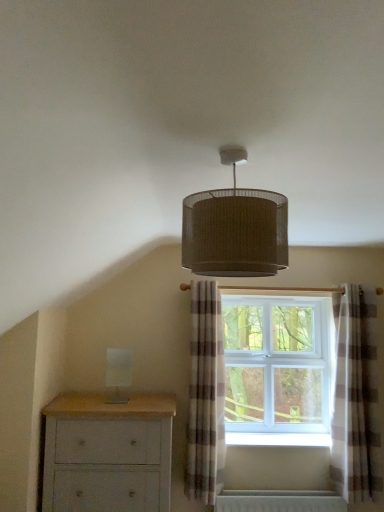
Describe the element at coordinates (118, 375) in the screenshot. I see `matte brown lampshade at upper center` at that location.

The height and width of the screenshot is (512, 384). Find the location of `plaid fabric curtain at center, which appears as the first curtain when viewed from the right`. plaid fabric curtain at center, which appears as the first curtain when viewed from the right is located at coordinates (355, 400).

What do you see at coordinates (355, 400) in the screenshot?
I see `plaid fabric curtain at center, which appears as the first curtain when viewed from the right` at bounding box center [355, 400].

This screenshot has height=512, width=384. Identify the location of light gray painted wood chest of drawers at lower left. (108, 453).

From the image's perspective, which object appears higher, plaid fabric curtain at center, positioned as the second curtain in left-to-right order, or white painted wood at lower center?

plaid fabric curtain at center, positioned as the second curtain in left-to-right order, from the image's perspective.

Considering the sizes of objects plaid fabric curtain at center, which appears as the first curtain when viewed from the right, and white painted wood at lower center in the image provided, who is bigger, plaid fabric curtain at center, which appears as the first curtain when viewed from the right, or white painted wood at lower center?

plaid fabric curtain at center, which appears as the first curtain when viewed from the right, is bigger.

Is plaid fabric curtain at center, positioned as the second curtain in left-to-right order, behind white painted wood at lower center?

No, it is in front of white painted wood at lower center.

Can you tell me how much plaid fabric curtain at center, which appears as the first curtain when viewed from the right, and white painted wood at lower center differ in facing direction?

0.00558 degrees separate the facing orientations of plaid fabric curtain at center, which appears as the first curtain when viewed from the right, and white painted wood at lower center.

Is white plastic window at center to the left or to the right of white painted wood at lower center in the image?

Based on their positions, white plastic window at center is located to the right of white painted wood at lower center.

Considering the sizes of white plastic window at center and white painted wood at lower center in the image, is white plastic window at center wider or thinner than white painted wood at lower center?

In the image, white plastic window at center appears to be more narrow than white painted wood at lower center.

From the picture: Could you tell me if white plastic window at center is facing white painted wood at lower center?

Yes, white plastic window at center is oriented towards white painted wood at lower center.

Does point (277, 356) appear closer or farther from the camera than point (312, 435)?

Clearly, point (277, 356) is more distant from the camera than point (312, 435).

Who is taller, white plastic window at center or plaid fabric curtain at center, positioned as the second curtain in left-to-right order?

plaid fabric curtain at center, positioned as the second curtain in left-to-right order.

Considering the sizes of objects white plastic window at center and plaid fabric curtain at center, which appears as the first curtain when viewed from the right, in the image provided, who is wider, white plastic window at center or plaid fabric curtain at center, which appears as the first curtain when viewed from the right,?

plaid fabric curtain at center, which appears as the first curtain when viewed from the right.

Is white plastic window at center not within plaid fabric curtain at center, positioned as the second curtain in left-to-right order?

white plastic window at center lies outside plaid fabric curtain at center, positioned as the second curtain in left-to-right order,'s area.

From the image's perspective, count 2nd curtains downward from the white plastic window at center and point to it. Please provide its 2D coordinates.

[(355, 400)]

Can you tell me how much plaid fabric curtain at center, the 2th curtain from the right, and light gray painted wood chest of drawers at lower left differ in facing direction?

0.00388 degrees.

From a real-world perspective, is plaid fabric curtain at center, the 2th curtain from the right, positioned over light gray painted wood chest of drawers at lower left based on gravity?

Yes, from a real-world perspective, plaid fabric curtain at center, the 2th curtain from the right, is on top of light gray painted wood chest of drawers at lower left.

You are a GUI agent. You are given a task and a screenshot of the screen. Output one action in this format:
    pyautogui.click(x=<x>, y=<y>)
    Task: Click on the curtain that is the 2nd object above the light gray painted wood chest of drawers at lower left (from a real-world perspective)
    Image resolution: width=384 pixels, height=512 pixels.
    Given the screenshot: What is the action you would take?
    [205, 394]

Considering their positions, is plaid fabric curtain at center, which ranks as the first curtain in left-to-right order, located in front of or behind light gray painted wood chest of drawers at lower left?

Clearly, plaid fabric curtain at center, which ranks as the first curtain in left-to-right order, is behind light gray painted wood chest of drawers at lower left.

Which is closer, (115, 364) or (345, 462)?

Point (115, 364) is positioned closer to the camera compared to point (345, 462).

Between matte brown lampshade at upper center and plaid fabric curtain at center, which appears as the first curtain when viewed from the right, which one has less height?

Standing shorter between the two is matte brown lampshade at upper center.

Considering the sizes of objects matte brown lampshade at upper center and plaid fabric curtain at center, positioned as the second curtain in left-to-right order, in the image provided, who is smaller, matte brown lampshade at upper center or plaid fabric curtain at center, positioned as the second curtain in left-to-right order,?

Smaller between the two is matte brown lampshade at upper center.

Is matte brown lampshade at upper center not within plaid fabric curtain at center, which appears as the first curtain when viewed from the right?

Yes, matte brown lampshade at upper center is outside of plaid fabric curtain at center, which appears as the first curtain when viewed from the right.

Which is less distant, (380, 470) or (261, 194)?

Point (261, 194)

From the image's perspective, relative to matte brown fabric lampshade at center, is plaid fabric curtain at center, which appears as the first curtain when viewed from the right, above or below?

plaid fabric curtain at center, which appears as the first curtain when viewed from the right, is situated lower than matte brown fabric lampshade at center in the image.

Between plaid fabric curtain at center, which appears as the first curtain when viewed from the right, and matte brown fabric lampshade at center, which one has smaller size?

matte brown fabric lampshade at center is smaller.

Looking at this image, can you confirm if plaid fabric curtain at center, positioned as the second curtain in left-to-right order, is shorter than matte brown fabric lampshade at center?

No.

Looking at this image, is white plastic window at center inside white painted wood at lower center?

No.

Does point (273, 445) come farther from viewer compared to point (239, 296)?

That is False.

Locate an element on the screen. The image size is (384, 512). window on the right of white painted wood at lower center is located at coordinates (277, 368).

From the image's perspective, is white painted wood at lower center beneath white plastic window at center?

Indeed, from the image's perspective, white painted wood at lower center is shown beneath white plastic window at center.

From the image's perspective, count 1st curtains upward from the white painted wood at lower center and point to it. Please provide its 2D coordinates.

[(355, 400)]

This screenshot has width=384, height=512. Find the location of `window behind the white painted wood at lower center`. window behind the white painted wood at lower center is located at coordinates (277, 368).

Looking at the image, which one is located closer to light gray painted wood chest of drawers at lower left, matte brown fabric lampshade at center or plaid fabric curtain at center, which ranks as the first curtain in left-to-right order?

Based on the image, plaid fabric curtain at center, which ranks as the first curtain in left-to-right order, appears to be nearer to light gray painted wood chest of drawers at lower left.

When comparing their distances from matte brown lampshade at upper center, does white painted wood at lower center or plaid fabric curtain at center, which appears as the first curtain when viewed from the right, seem closer?

white painted wood at lower center is closer to matte brown lampshade at upper center.

Looking at the image, which one is located closer to plaid fabric curtain at center, which ranks as the first curtain in left-to-right order, plaid fabric curtain at center, positioned as the second curtain in left-to-right order, or matte brown lampshade at upper center?

Among the two, matte brown lampshade at upper center is located nearer to plaid fabric curtain at center, which ranks as the first curtain in left-to-right order.

From the image, which object appears to be nearer to white plastic window at center, matte brown lampshade at upper center or light gray painted wood chest of drawers at lower left?

light gray painted wood chest of drawers at lower left.

Which object lies further to the anchor point white plastic window at center, white painted wood at lower center or plaid fabric curtain at center, the 2th curtain from the right?

The object further to white plastic window at center is plaid fabric curtain at center, the 2th curtain from the right.

Looking at this image, looking at the image, which one is located closer to white painted wood at lower center, plaid fabric curtain at center, which appears as the first curtain when viewed from the right, or matte brown lampshade at upper center?

Based on the image, plaid fabric curtain at center, which appears as the first curtain when viewed from the right, appears to be nearer to white painted wood at lower center.

Looking at the image, which one is located further to matte brown fabric lampshade at center, white plastic window at center or plaid fabric curtain at center, which ranks as the first curtain in left-to-right order?

white plastic window at center is further to matte brown fabric lampshade at center.

Looking at the image, which one is located further to plaid fabric curtain at center, the 2th curtain from the right, white painted wood at lower center or matte brown lampshade at upper center?

Among the two, matte brown lampshade at upper center is located further to plaid fabric curtain at center, the 2th curtain from the right.

Image resolution: width=384 pixels, height=512 pixels. Identify the location of light fixture between light gray painted wood chest of drawers at lower left and white plastic window at center in the horizontal direction. (118, 375).

I want to click on window between plaid fabric curtain at center, the 2th curtain from the right, and plaid fabric curtain at center, which appears as the first curtain when viewed from the right, in the horizontal direction, so click(277, 368).

Locate an element on the screen. light fixture positioned between matte brown fabric lampshade at center and white plastic window at center from near to far is located at coordinates (118, 375).

Where is `window sill between plaid fabric curtain at center, the 2th curtain from the right, and white plastic window at center, in the horizontal direction`? This screenshot has height=512, width=384. window sill between plaid fabric curtain at center, the 2th curtain from the right, and white plastic window at center, in the horizontal direction is located at coordinates (278, 439).